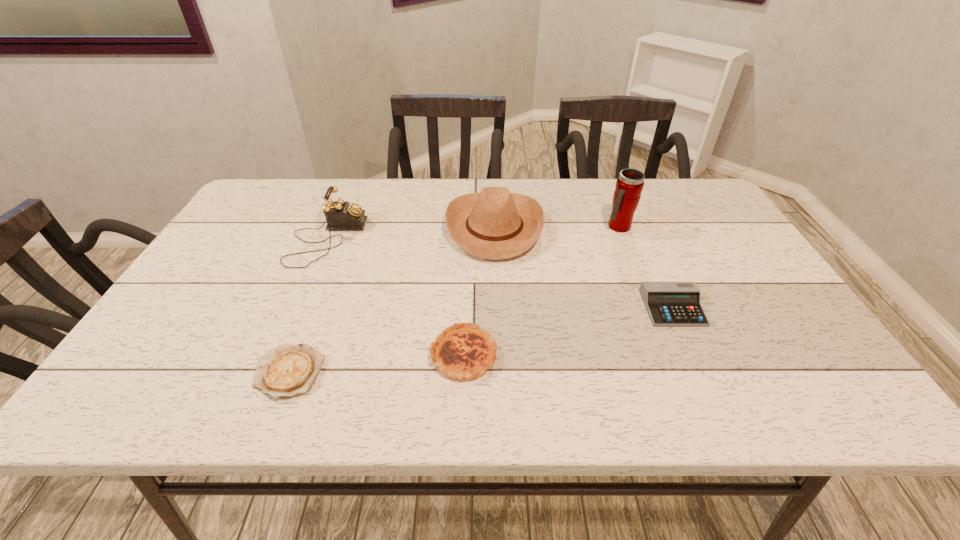
The width and height of the screenshot is (960, 540). In the image, there is a desktop. Find the location of `free space at the left edge`. free space at the left edge is located at coordinates (212, 344).

Identify the location of free space at the right edge of the desktop. The width and height of the screenshot is (960, 540). (800, 342).

Find the location of a particular element. This screenshot has width=960, height=540. vacant space at the far left corner of the desktop is located at coordinates pyautogui.click(x=279, y=186).

Where is `blank space at the far right corner of the desktop`? The width and height of the screenshot is (960, 540). blank space at the far right corner of the desktop is located at coordinates (690, 206).

Locate an element on the screen. unoccupied area between the telephone and the right quiche is located at coordinates (396, 297).

Locate an element on the screen. free spot between the cowboy hat and the telephone is located at coordinates (411, 233).

Where is `unoccupied position between the right quiche and the telephone`? The height and width of the screenshot is (540, 960). unoccupied position between the right quiche and the telephone is located at coordinates coord(396,297).

Identify the location of free space between the cowboy hat and the calculator. The width and height of the screenshot is (960, 540). (584, 267).

At what (x,y) coordinates should I click in order to perform the action: click on free space between the telephone and the shorter quiche. Please return your answer as a coordinate pair (x, y). This screenshot has height=540, width=960. Looking at the image, I should click on (307, 306).

The height and width of the screenshot is (540, 960). In order to click on free space between the right quiche and the tallest object in this screenshot , I will do `click(541, 291)`.